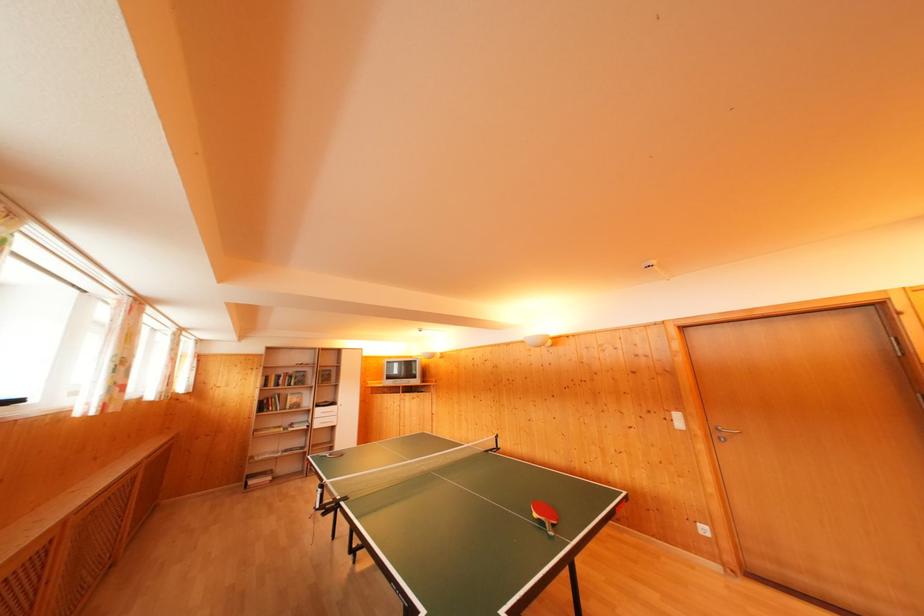
Where is `white light switch`? white light switch is located at coordinates (677, 419).